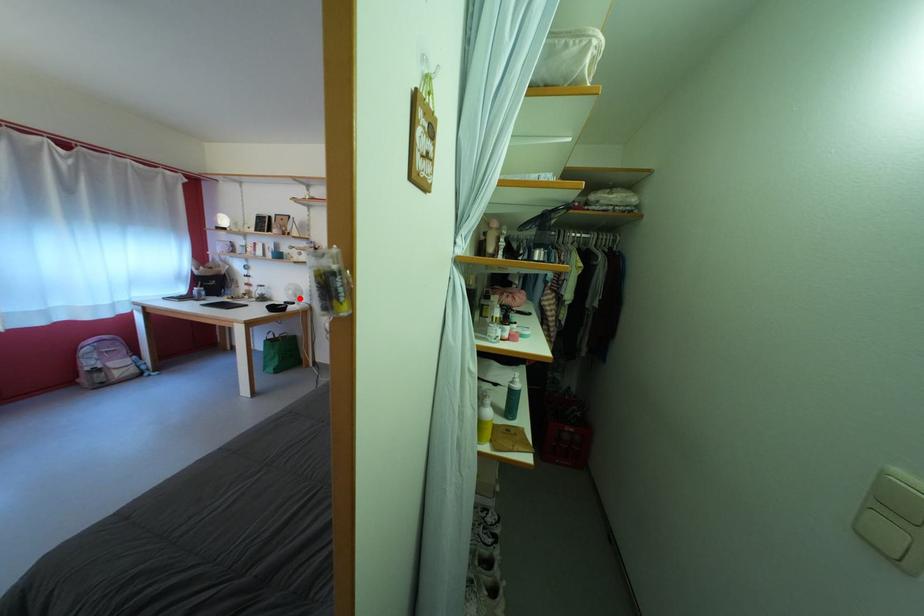
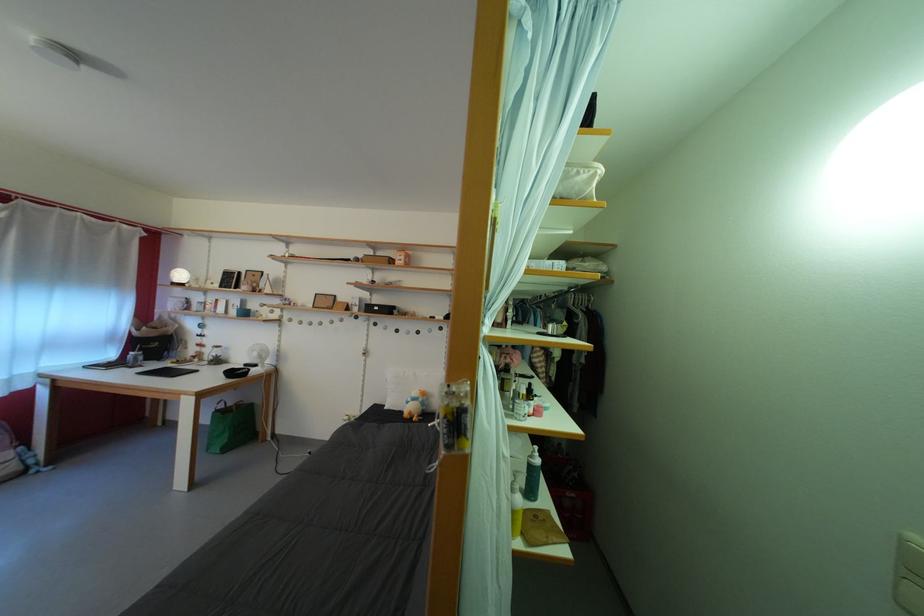
Question: I am providing you with two images of the same scene from different viewpoints. A red point is marked on the first image. Is the red point's position out of view in image 2?

Choices:
 (A) Yes
 (B) No

Answer: (B)